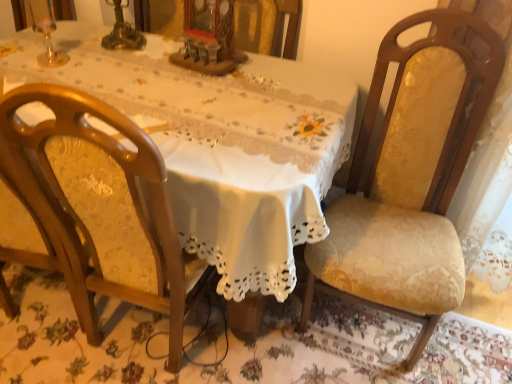
Question: Is wooden chair at left, acting as the 1th chair starting from the left, to the right of white lace tablecloth at center from the viewer's perspective?

Choices:
 (A) no
 (B) yes

Answer: (B)

Question: Can you confirm if wooden chair at left, which ranks as the 2th chair in right-to-left order, is taller than white lace tablecloth at center?

Choices:
 (A) no
 (B) yes

Answer: (B)

Question: Is wooden chair at left, acting as the 1th chair starting from the left, surrounding white lace tablecloth at center?

Choices:
 (A) yes
 (B) no

Answer: (B)

Question: Can you confirm if wooden chair at left, which ranks as the 2th chair in right-to-left order, is smaller than white lace tablecloth at center?

Choices:
 (A) no
 (B) yes

Answer: (B)

Question: Are wooden chair at left, acting as the 1th chair starting from the left, and white lace tablecloth at center making contact?

Choices:
 (A) yes
 (B) no

Answer: (B)

Question: From the image's perspective, relative to white lace tablecloth at center, is wooden chair at left, acting as the 1th chair starting from the left, above or below?

Choices:
 (A) below
 (B) above

Answer: (A)

Question: Based on their sizes in the image, would you say wooden chair at left, which ranks as the 2th chair in right-to-left order, is bigger or smaller than white lace tablecloth at center?

Choices:
 (A) big
 (B) small

Answer: (B)

Question: Does point (35, 190) appear closer or farther from the camera than point (180, 104)?

Choices:
 (A) farther
 (B) closer

Answer: (B)

Question: From a real-world perspective, is wooden chair at left, acting as the 1th chair starting from the left, above or below white lace tablecloth at center?

Choices:
 (A) above
 (B) below

Answer: (A)

Question: In the image, is velvet yellow chair at right, the second chair from the left, on the left side or the right side of wooden chair at left, acting as the 1th chair starting from the left?

Choices:
 (A) left
 (B) right

Answer: (B)

Question: From the image's perspective, is velvet yellow chair at right, marked as the 1th chair in a right-to-left arrangement, above or below wooden chair at left, which ranks as the 2th chair in right-to-left order?

Choices:
 (A) below
 (B) above

Answer: (B)

Question: From a real-world perspective, is velvet yellow chair at right, marked as the 1th chair in a right-to-left arrangement, above or below wooden chair at left, acting as the 1th chair starting from the left?

Choices:
 (A) below
 (B) above

Answer: (B)

Question: In the image, is velvet yellow chair at right, marked as the 1th chair in a right-to-left arrangement, positioned in front of or behind wooden chair at left, which ranks as the 2th chair in right-to-left order?

Choices:
 (A) front
 (B) behind

Answer: (B)

Question: From a real-world perspective, relative to white lace tablecloth at center, is velvet yellow chair at right, marked as the 1th chair in a right-to-left arrangement, vertically above or below?

Choices:
 (A) below
 (B) above

Answer: (B)

Question: Choose the correct answer: Is velvet yellow chair at right, the second chair from the left, inside white lace tablecloth at center or outside it?

Choices:
 (A) inside
 (B) outside

Answer: (B)